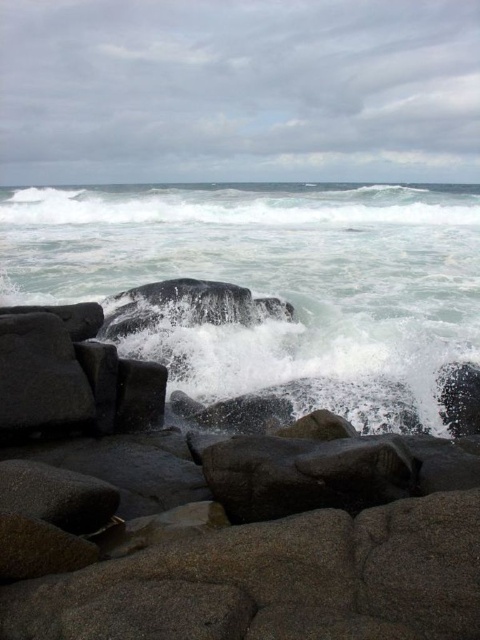
You are a photographer standing on the beach and want to capture the interaction between the gray granite rocks at lower center and the white frothy water at center. Which object appears taller in the photo?

The white frothy water at center appears taller than the gray granite rocks at lower center in the photo.

You are standing on the rocky shore and want to reach the point marked at coordinates point (x=83, y=572). Given that the turbulent waves are currently reaching up to 2 meters from the viewer, is it safe to walk there without getting wet?

The point (x=83, y=572) is 2.58 meters away from the viewer, which is beyond the 2 meters reach of the turbulent waves. Therefore, it is safe to walk there without getting wet.

You are a marine biologist studying coastal erosion. You observe the smooth granite rocks at lower center and the white frothy wave at upper center. Given that the wave is moving towards the rocks, will it reach them before receding? Use the distance between them to determine your answer.

The distance between the smooth granite rocks at lower center and the white frothy wave at upper center is 61.64 meters. Since waves typically travel several hundred meters before receding, the wave will likely reach the rocks before receding.